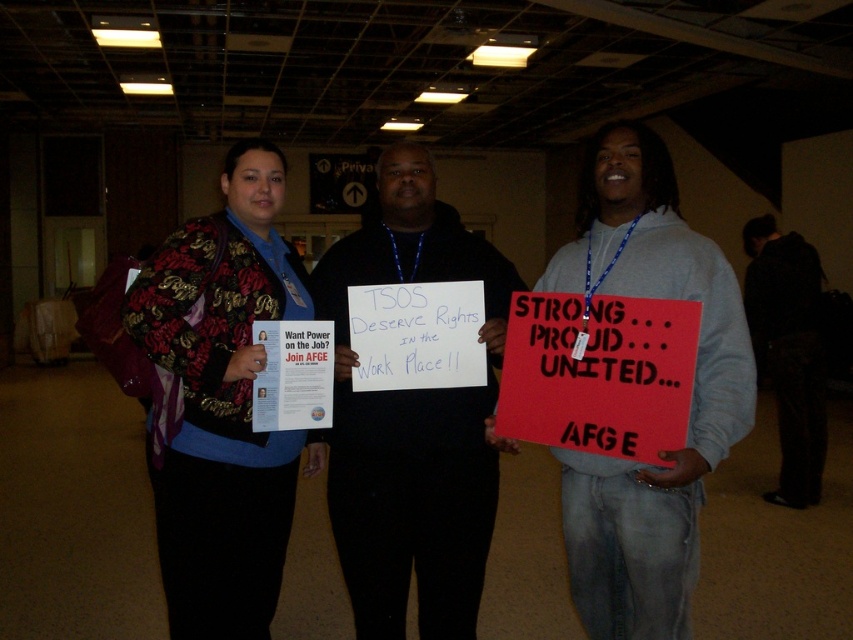
Between point (165, 362) and point (786, 380), which one is positioned in front?

Point (165, 362) is more forward.

Is floral-patterned jacket at center wider than dark fabric pants at right?

No, floral-patterned jacket at center is not wider than dark fabric pants at right.

Is point (149, 330) more distant than point (805, 499)?

No.

At what (x,y) coordinates should I click in order to perform the action: click on floral-patterned jacket at center. Please return your answer as a coordinate pair (x, y). Image resolution: width=853 pixels, height=640 pixels. Looking at the image, I should click on (223, 403).

Which of these two, black hoodie at center or matte black shirt at center, stands shorter?

matte black shirt at center is shorter.

Can you confirm if black hoodie at center is positioned to the left of matte black shirt at center?

Correct, you'll find black hoodie at center to the left of matte black shirt at center.

The height and width of the screenshot is (640, 853). I want to click on black hoodie at center, so click(412, 420).

Is black hoodie at center taller than dark fabric pants at right?

In fact, black hoodie at center may be shorter than dark fabric pants at right.

The image size is (853, 640). What are the coordinates of `black hoodie at center` in the screenshot? It's located at (412, 420).

Where is `black hoodie at center`? The height and width of the screenshot is (640, 853). black hoodie at center is located at coordinates (412, 420).